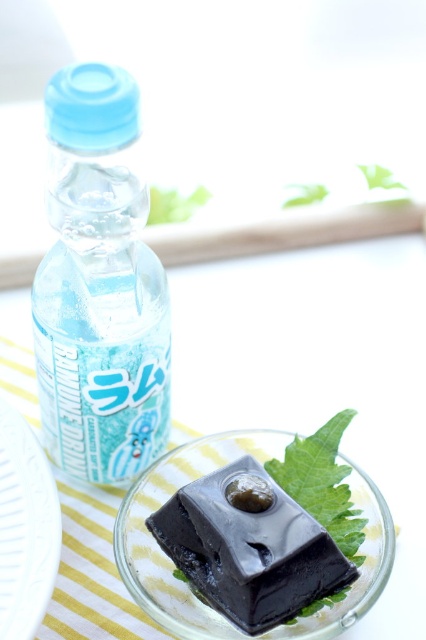
Does blue plastic bottle at left have a lesser height compared to white textured platter at lower left?

In fact, blue plastic bottle at left may be taller than white textured platter at lower left.

What do you see at coordinates (98, 285) in the screenshot? I see `blue plastic bottle at left` at bounding box center [98, 285].

Does point (109, 454) come in front of point (43, 493)?

No, (109, 454) is further to viewer.

The width and height of the screenshot is (426, 640). I want to click on blue plastic bottle at left, so [x=98, y=285].

Between shiny dark chocolate at center and white textured platter at lower left, which one is positioned higher?

white textured platter at lower left is above.

Who is more distant from viewer, (167,554) or (20,474)?

The point (167,554) is more distant.

This screenshot has height=640, width=426. What are the coordinates of `shiny dark chocolate at center` in the screenshot? It's located at (249, 548).

Which is more to the left, blue plastic bottle at left or shiny dark chocolate at center?

blue plastic bottle at left is more to the left.

Which is in front, point (46, 118) or point (178, 545)?

Point (46, 118)

Where is `blue plastic bottle at left`? The height and width of the screenshot is (640, 426). blue plastic bottle at left is located at coordinates (98, 285).